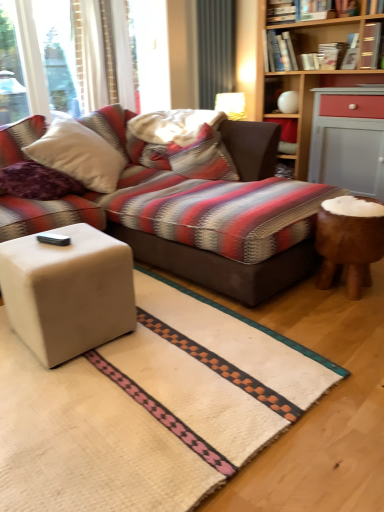
Question: Is hardcover book at upper right, positioned as the 5th book in left-to-right order, further to the viewer compared to hardcover book at upper right, which is the 6th book from left to right?

Choices:
 (A) yes
 (B) no

Answer: (A)

Question: Is hardcover book at upper right, marked as the second book in a right-to-left arrangement, at the back of hardcover book at upper right, arranged as the third book when viewed from the right?

Choices:
 (A) no
 (B) yes

Answer: (A)

Question: Does hardcover book at upper right, positioned as the 5th book in left-to-right order, have a lesser width compared to hardcover book at upper right, marked as the second book in a right-to-left arrangement?

Choices:
 (A) yes
 (B) no

Answer: (A)

Question: From the image's perspective, is hardcover book at upper right, positioned as the 5th book in left-to-right order, beneath hardcover book at upper right, which is the 6th book from left to right?

Choices:
 (A) yes
 (B) no

Answer: (B)

Question: Would you say hardcover book at upper right, arranged as the third book when viewed from the right, is outside hardcover book at upper right, which is the 6th book from left to right?

Choices:
 (A) yes
 (B) no

Answer: (A)

Question: In terms of width, does wooden book at upper right, the first book viewed from the right, look wider or thinner when compared to striped fabric pillow at center, the first pillow when ordered from right to left?

Choices:
 (A) thin
 (B) wide

Answer: (A)

Question: In terms of size, does wooden book at upper right, which is the seventh book from left to right, appear bigger or smaller than striped fabric pillow at center, the first pillow when ordered from right to left?

Choices:
 (A) small
 (B) big

Answer: (A)

Question: Would you say wooden book at upper right, the first book viewed from the right, is to the left or to the right of striped fabric pillow at center, the 2th pillow positioned from the front, in the picture?

Choices:
 (A) right
 (B) left

Answer: (A)

Question: Considering the positions of point (372, 62) and point (200, 153), is point (372, 62) closer or farther from the camera than point (200, 153)?

Choices:
 (A) farther
 (B) closer

Answer: (A)

Question: In the image, is striped fabric pillow at center, the second pillow from the left, on the left side or the right side of hardcover book at upper right, placed as the 4th book when sorted from left to right?

Choices:
 (A) left
 (B) right

Answer: (A)

Question: Is point (178, 143) positioned closer to the camera than point (329, 64)?

Choices:
 (A) farther
 (B) closer

Answer: (B)

Question: From a real-world perspective, is striped fabric pillow at center, the 2th pillow positioned from the front, physically located above or below hardcover book at upper right, the fourth book viewed from the right?

Choices:
 (A) above
 (B) below

Answer: (B)

Question: From the image's perspective, is striped fabric pillow at center, the first pillow when ordered from right to left, located above or below hardcover book at upper right, the fourth book viewed from the right?

Choices:
 (A) below
 (B) above

Answer: (A)

Question: From a real-world perspective, relative to beige matte cube at lower left, is hardcover book at upper center, which is the first book in left-to-right order, vertically above or below?

Choices:
 (A) above
 (B) below

Answer: (A)

Question: Is point (289, 9) closer or farther from the camera than point (119, 302)?

Choices:
 (A) farther
 (B) closer

Answer: (A)